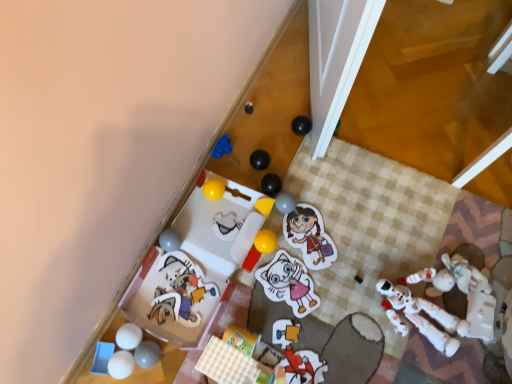
This screenshot has height=384, width=512. Identify the location of vacant space to the right of cartoon cat plush at lower left, placed as the 11th toy when sorted from right to left. (239, 294).